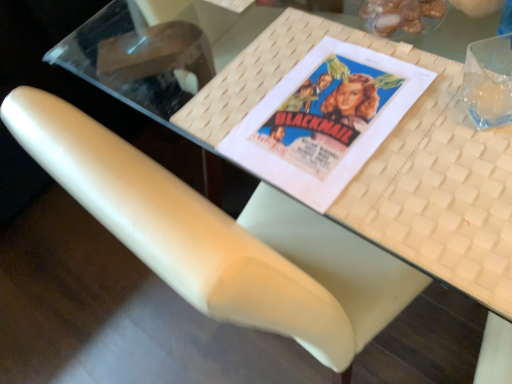
In order to click on white woven placemat at upper center in this screenshot , I will do `click(394, 159)`.

What is the approximate height of shiny brown nuts at upper right?

The height of shiny brown nuts at upper right is 2.30 inches.

This screenshot has height=384, width=512. I want to click on shiny brown nuts at upper right, so click(x=402, y=16).

At what (x,y) coordinates should I click in order to perform the action: click on white leather chair at center. Please return your answer as a coordinate pair (x, y). This screenshot has height=384, width=512. Looking at the image, I should click on (221, 238).

Can you confirm if white woven placemat at upper center is thinner than shiny brown nuts at upper right?

In fact, white woven placemat at upper center might be wider than shiny brown nuts at upper right.

In the image, is white woven placemat at upper center positioned in front of or behind shiny brown nuts at upper right?

Clearly, white woven placemat at upper center is in front of shiny brown nuts at upper right.

Which is nearer, [471,149] or [401,21]?

Point [471,149].

Looking at this image, how different are the orientations of white woven placemat at upper center and shiny brown nuts at upper right in degrees?

The angle between the facing direction of white woven placemat at upper center and the facing direction of shiny brown nuts at upper right is 178 degrees.

Is shiny brown nuts at upper right surrounding white leather chair at center?

No, white leather chair at center is not a part of shiny brown nuts at upper right.

Considering their positions, is shiny brown nuts at upper right located in front of or behind white leather chair at center?

Clearly, shiny brown nuts at upper right is in front of white leather chair at center.

Does shiny brown nuts at upper right have a lesser height compared to white leather chair at center?

No, shiny brown nuts at upper right is not shorter than white leather chair at center.

Is there a large distance between shiny brown nuts at upper right and white leather chair at center?

That's not correct — shiny brown nuts at upper right is a little close to white leather chair at center.

From the picture: Which object is further away from the camera taking this photo, white leather chair at center or matte paper movie poster at center?

white leather chair at center is more distant.

Which is more to the right, white leather chair at center or matte paper movie poster at center?

From the viewer's perspective, matte paper movie poster at center appears more on the right side.

From a real-world perspective, is white leather chair at center above or below matte paper movie poster at center?

From a real-world perspective, white leather chair at center is physically below matte paper movie poster at center.

What's the angular difference between white leather chair at center and matte paper movie poster at center's facing directions?

89.1 degrees separate the facing orientations of white leather chair at center and matte paper movie poster at center.

In the scene shown: From the image's perspective, is white leather chair at center below white woven placemat at upper center?

Correct, white leather chair at center appears lower than white woven placemat at upper center in the image.

Is white leather chair at center outside of white woven placemat at upper center?

Yes.

Based on the photo, is white leather chair at center taller or shorter than white woven placemat at upper center?

In the image, white leather chair at center appears to be taller than white woven placemat at upper center.

Identify the location of paperback book above the white woven placemat at upper center (from the image's perspective). (325, 120).

Which is less distant, (301, 178) or (487, 294)?

Positioned in front is point (487, 294).

Is matte paper movie poster at center aimed at shiny brown nuts at upper right?

Yes, matte paper movie poster at center is aimed at shiny brown nuts at upper right.

Image resolution: width=512 pixels, height=384 pixels. In order to click on food lying above the matte paper movie poster at center (from the image's perspective) in this screenshot , I will do `click(402, 16)`.

Is matte paper movie poster at center shorter than shiny brown nuts at upper right?

Correct, matte paper movie poster at center is not as tall as shiny brown nuts at upper right.

From a real-world perspective, which is physically below, matte paper movie poster at center or shiny brown nuts at upper right?

matte paper movie poster at center is physically lower.

Is white woven placemat at upper center shorter than matte paper movie poster at center?

No, white woven placemat at upper center is not shorter than matte paper movie poster at center.

From a real-world perspective, is white woven placemat at upper center physically located above or below matte paper movie poster at center?

Clearly, from a real-world perspective, white woven placemat at upper center is below matte paper movie poster at center.

You are a GUI agent. You are given a task and a screenshot of the screen. Output one action in this format:
    pyautogui.click(x=<x>, y=<y>)
    Task: Click on the paperback book lying above the white woven placemat at upper center (from the image's perspective)
    The width and height of the screenshot is (512, 384).
    Given the screenshot: What is the action you would take?
    pyautogui.click(x=325, y=120)

Does white woven placemat at upper center have a larger size compared to matte paper movie poster at center?

Correct, white woven placemat at upper center is larger in size than matte paper movie poster at center.

In the image, there is a shiny brown nuts at upper right. Where is `table below it (from a real-world perspective)`? The image size is (512, 384). table below it (from a real-world perspective) is located at coordinates (394, 159).

The width and height of the screenshot is (512, 384). There is a white leather chair at center. What are the coordinates of `food above it (from a real-world perspective)` in the screenshot? It's located at (402, 16).

Consider the image. Looking at the image, which one is located closer to shiny brown nuts at upper right, white woven placemat at upper center or matte paper movie poster at center?

Among the two, matte paper movie poster at center is located nearer to shiny brown nuts at upper right.

Which object lies nearer to the anchor point white woven placemat at upper center, matte paper movie poster at center or shiny brown nuts at upper right?

matte paper movie poster at center lies closer to white woven placemat at upper center than the other object.

Considering their positions, is matte paper movie poster at center positioned further to white leather chair at center than white woven placemat at upper center?

matte paper movie poster at center lies further to white leather chair at center than the other object.

Looking at the image, which one is located closer to matte paper movie poster at center, white leather chair at center or shiny brown nuts at upper right?

shiny brown nuts at upper right is closer to matte paper movie poster at center.

Estimate the real-world distances between objects in this image. Which object is closer to white woven placemat at upper center, matte paper movie poster at center or white leather chair at center?

matte paper movie poster at center.

Considering their positions, is white leather chair at center positioned closer to white woven placemat at upper center than shiny brown nuts at upper right?

Based on the image, shiny brown nuts at upper right appears to be nearer to white woven placemat at upper center.

Considering their positions, is white leather chair at center positioned closer to shiny brown nuts at upper right than matte paper movie poster at center?

The object closer to shiny brown nuts at upper right is matte paper movie poster at center.

Looking at the image, which one is located closer to white woven placemat at upper center, white leather chair at center or matte paper movie poster at center?

matte paper movie poster at center.

The image size is (512, 384). I want to click on table between shiny brown nuts at upper right and white leather chair at center vertically, so click(x=394, y=159).

The width and height of the screenshot is (512, 384). Identify the location of paperback book between shiny brown nuts at upper right and white leather chair at center in the up-down direction. (325, 120).

Where is `paperback book between white woven placemat at upper center and shiny brown nuts at upper right along the z-axis`? paperback book between white woven placemat at upper center and shiny brown nuts at upper right along the z-axis is located at coordinates (325, 120).

This screenshot has height=384, width=512. Identify the location of table between matte paper movie poster at center and white leather chair at center in the vertical direction. (394, 159).